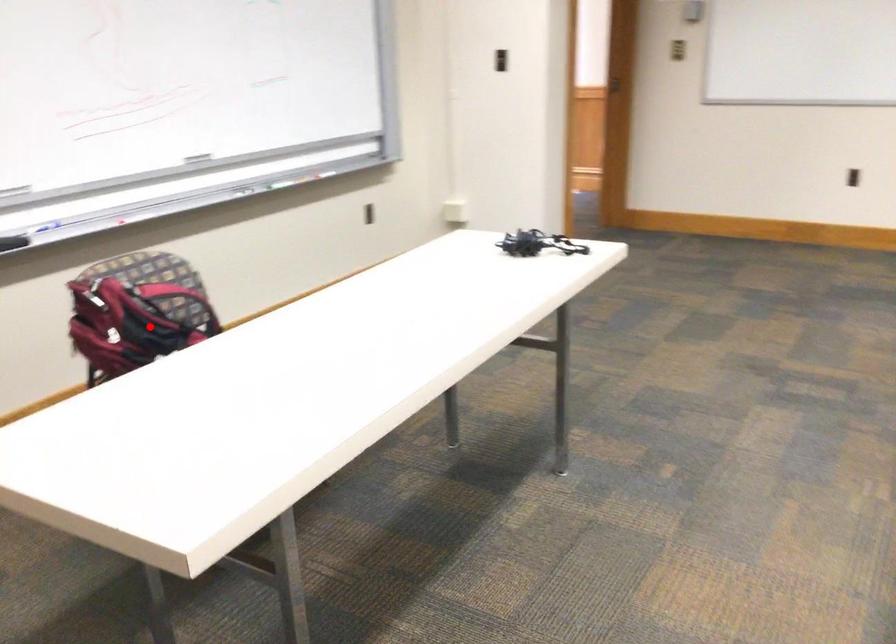
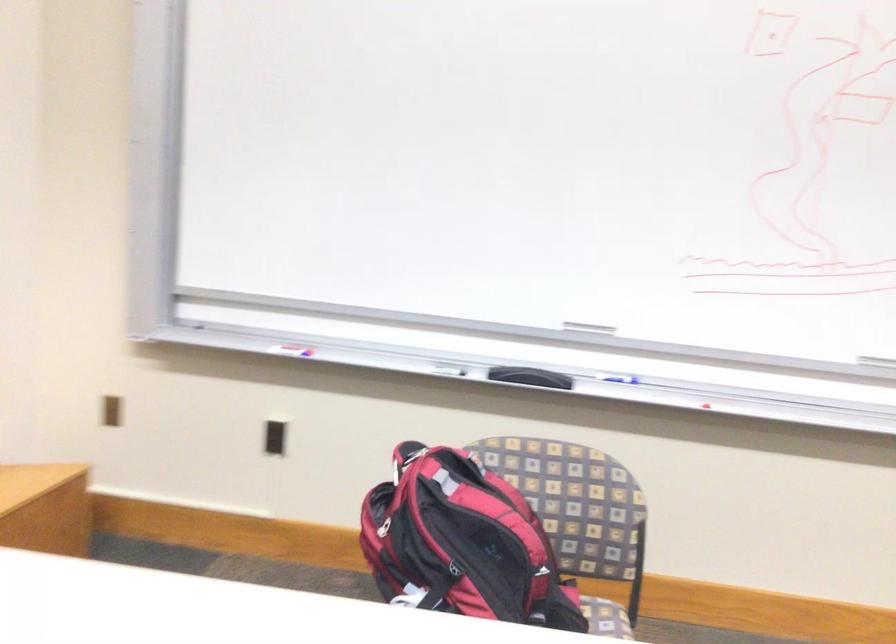
Question: A red point is marked in image1. In image2, is the corresponding 3D point closer to the camera or farther? Reply with the corresponding letter.

Choices:
 (A) The corresponding 3D point is closer.
 (B) The corresponding 3D point is farther.

Answer: (A)